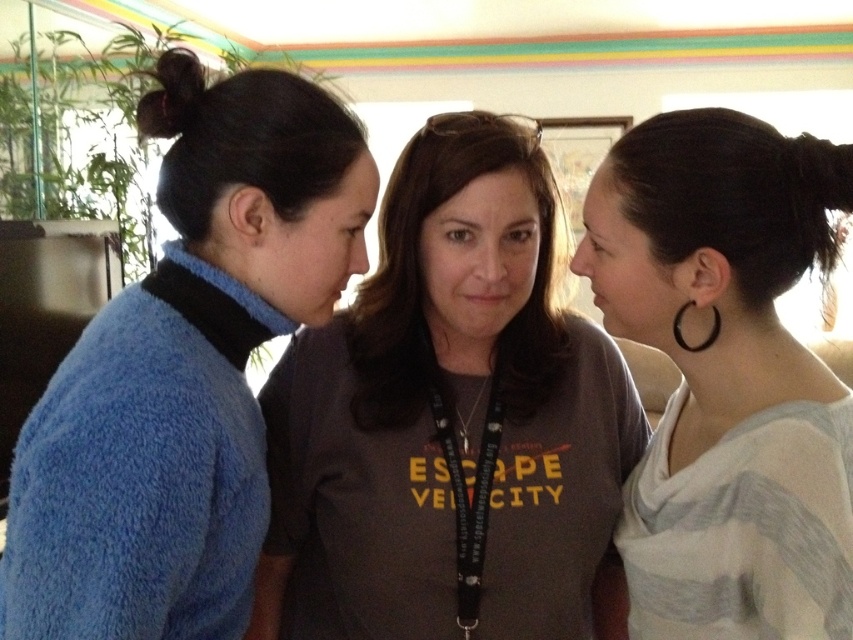
Question: Does dark gray t-shirt at center lie behind black hair at left?

Choices:
 (A) yes
 (B) no

Answer: (A)

Question: Among these points, which one is nearest to the camera?

Choices:
 (A) (712, 308)
 (B) (729, 531)
 (C) (218, 320)
 (D) (425, 490)

Answer: (B)

Question: Is dark gray t-shirt at center above blue fuzzy sweater at left?

Choices:
 (A) no
 (B) yes

Answer: (A)

Question: Estimate the real-world distances between objects in this image. Which object is closer to the dark gray t-shirt at center?

Choices:
 (A) black matte hoop earring at upper right
 (B) black hair at left
 (C) black rubber hoop at right
 (D) blue fuzzy sweater at left

Answer: (A)

Question: Can you confirm if dark gray t-shirt at center is wider than blue fuzzy sweater at left?

Choices:
 (A) no
 (B) yes

Answer: (B)

Question: Which object is positioned farthest from the dark gray t-shirt at center?

Choices:
 (A) black rubber hoop at right
 (B) blue fuzzy sweater at left
 (C) black matte hoop earring at upper right
 (D) black hair at left

Answer: (D)